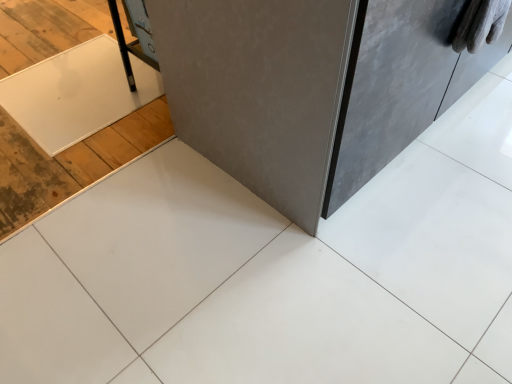
The width and height of the screenshot is (512, 384). Describe the element at coordinates (77, 93) in the screenshot. I see `white glossy board at upper left` at that location.

The image size is (512, 384). In order to click on white glossy board at upper left in this screenshot , I will do `click(77, 93)`.

The image size is (512, 384). Identify the location of white glossy board at upper left. (77, 93).